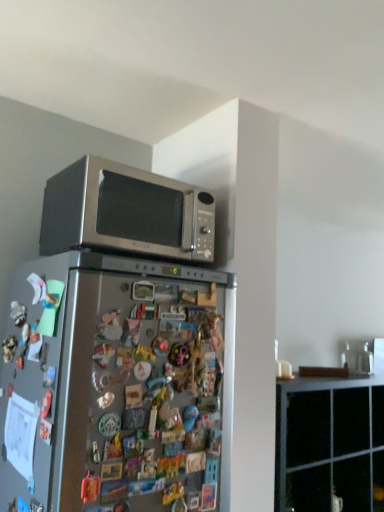
Question: In terms of height, does black matte cabinet at upper right look taller or shorter compared to satin silver refrigerator at center?

Choices:
 (A) short
 (B) tall

Answer: (A)

Question: In terms of width, does black matte cabinet at upper right look wider or thinner when compared to satin silver refrigerator at center?

Choices:
 (A) thin
 (B) wide

Answer: (A)

Question: Estimate the real-world distances between objects in this image. Which object is closer to the satin silver microwave at upper center?

Choices:
 (A) satin silver refrigerator at center
 (B) black matte cabinet at upper right

Answer: (A)

Question: Estimate the real-world distances between objects in this image. Which object is closer to the satin silver refrigerator at center?

Choices:
 (A) satin silver microwave at upper center
 (B) black matte cabinet at upper right

Answer: (A)